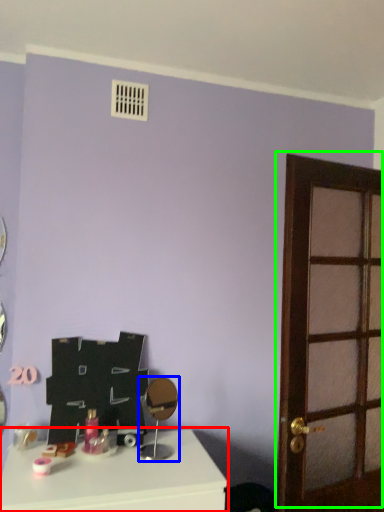
Question: Which is nearer to the table (highlighted by a red box)? mirror (highlighted by a blue box) or door (highlighted by a green box).

Choices:
 (A) mirror
 (B) door

Answer: (A)